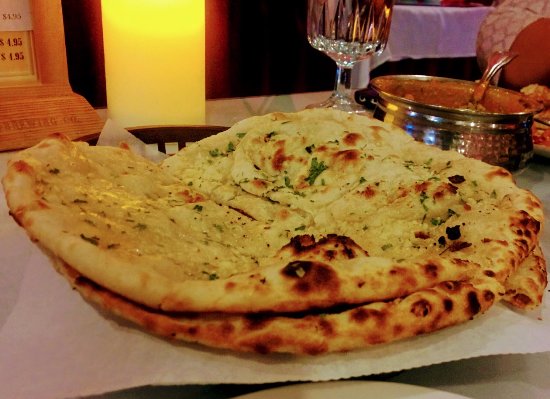
What are the coordinates of `glass stem` in the screenshot? It's located at (342, 81).